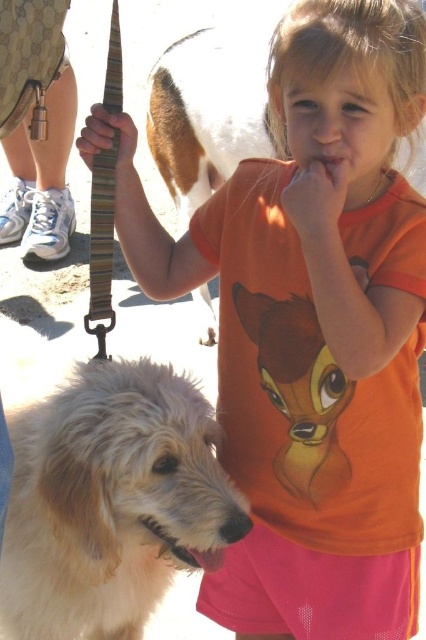
You are a dog owner who wants to bring both the white fluffy dog at center and the white fur dog at center to a park. However, your car only has enough space for one dog. Based on their sizes, which dog should you choose to fit better in your car?

The white fluffy dog at center is smaller than the white fur dog at center, so you should choose the white fluffy dog at center to fit better in your car.

You are standing at the point marked as point [163,420] in the image. The dog is 2 feet tall. Can you determine if the dog can comfortably stand between you and the viewer?

The distance between point [163,420] and the viewer is 4.19 feet. Since the dog is only 2 feet tall, it can comfortably stand between you and the viewer as there is enough space.

You are a photographer trying to capture the dog in the image. The dog is at point (111, 500). If you want to focus on the dog, where should you aim your camera?

The point (111, 500) marks the white fluffy dog at center, so you should aim your camera at point (111, 500) to focus on the dog.